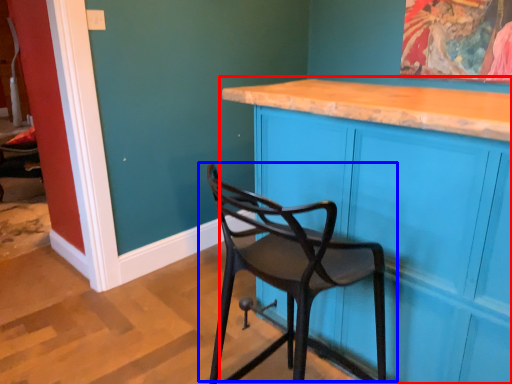
Question: Which object is closer to the camera taking this photo, cabinetry (highlighted by a red box) or chair (highlighted by a blue box)?

Choices:
 (A) cabinetry
 (B) chair

Answer: (B)